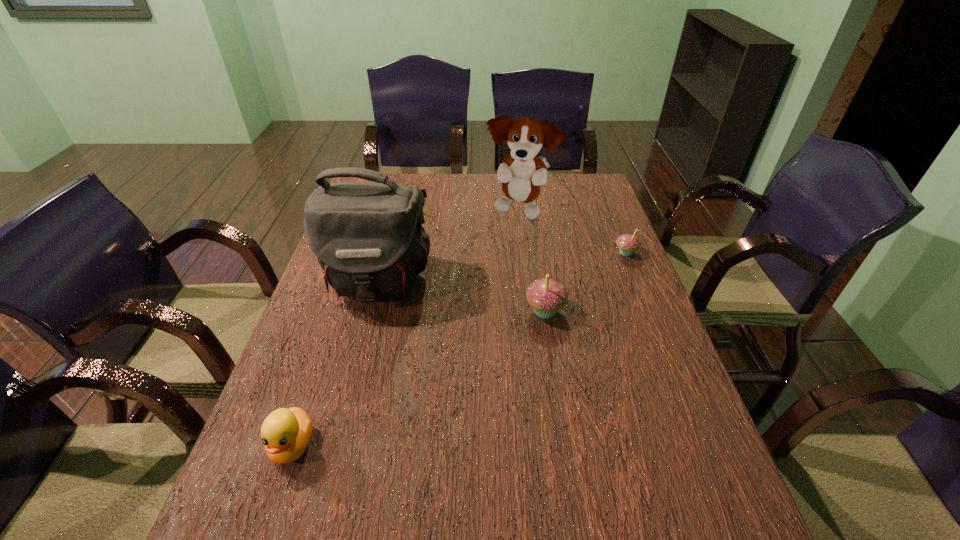
What are the coordinates of `the third tallest object` in the screenshot? It's located at (547, 296).

Find the location of a particular element. This screenshot has height=540, width=960. the nearer cupcake is located at coordinates (547, 296).

Find the location of `the shorter cupcake`. the shorter cupcake is located at coordinates (628, 244).

Image resolution: width=960 pixels, height=540 pixels. Find the location of `the right cupcake`. the right cupcake is located at coordinates (628, 244).

This screenshot has width=960, height=540. Identify the location of pocket watch. (438, 210).

Locate an element on the screen. This screenshot has width=960, height=540. puppy is located at coordinates pyautogui.click(x=521, y=173).

Locate an element on the screen. Image resolution: width=960 pixels, height=540 pixels. shoulder bag is located at coordinates (368, 237).

You are a GUI agent. You are given a task and a screenshot of the screen. Output one action in this format:
    pyautogui.click(x=<x>, y=<y>)
    Task: Click on the nearest object
    
    Given the screenshot: What is the action you would take?
    point(286,433)

Where is `free point located on the right of the taller cupcake`? free point located on the right of the taller cupcake is located at coordinates (618, 311).

Find the location of a particular element. This screenshot has width=960, height=540. vacant space situated 0.400m on the back of the farther cupcake is located at coordinates (597, 182).